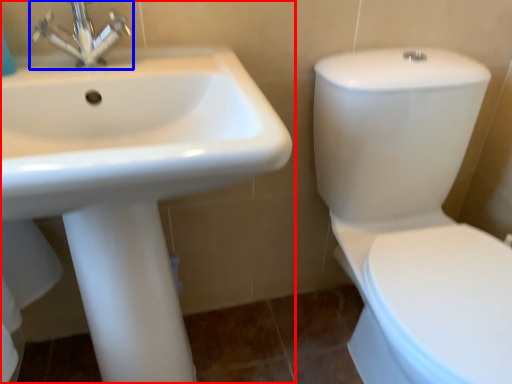
Question: Which point is further to the camera, sink (highlighted by a red box) or tap (highlighted by a blue box)?

Choices:
 (A) sink
 (B) tap

Answer: (B)